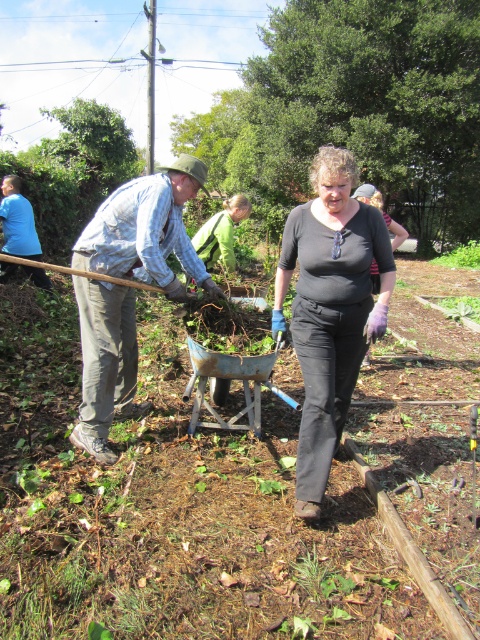
You are standing at the point marked by the coordinates point at (x=173, y=509). Looking around, you see a metallic wheelbarrow at center. Which direction should you walk to reach the person in the light blue plaid shirt on the left?

The person in the light blue plaid shirt on the left is to the left of the metallic wheelbarrow at center. Since you are at the point indicating the metallic wheelbarrow at center, you should walk to the left to reach them.

Please describe the exact location of the metallic wheelbarrow at center in the image using coordinate points.

The metallic wheelbarrow at center is located at coordinate point (173, 509).